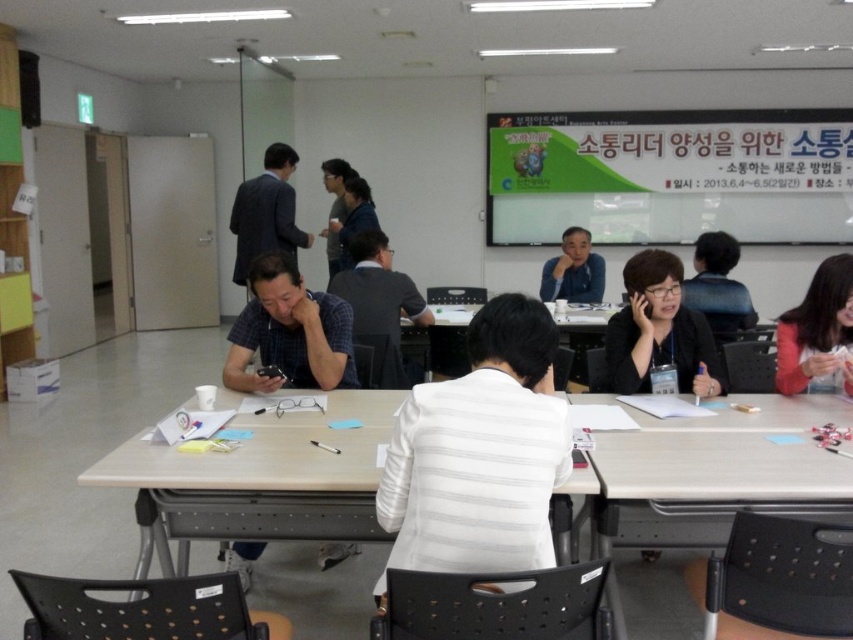
You are organizing a small workshop and need to seat two participants. You have a light brown wooden table at center and a matte black jacket at lower right. Which object can accommodate more people comfortably?

The light brown wooden table at center is larger in size than the matte black jacket at lower right, so it can accommodate more people comfortably.

You are standing in the conference room and want to reach the point at coordinates (607, 305). The room is 20 feet long. Can you walk directly to that point without needing to go around any obstacles?

The point at coordinates (607, 305) is 16.30 feet away from the camera. Since the room is 20 feet long, you can walk directly to that point without needing to go around obstacles as there is sufficient space.

You are standing at the entrance of the conference room and see the light brown wooden table at center and the matte black jacket at lower right. Which object is closer to you?

The light brown wooden table at center is closer to you because it is in front of the matte black jacket at lower right.